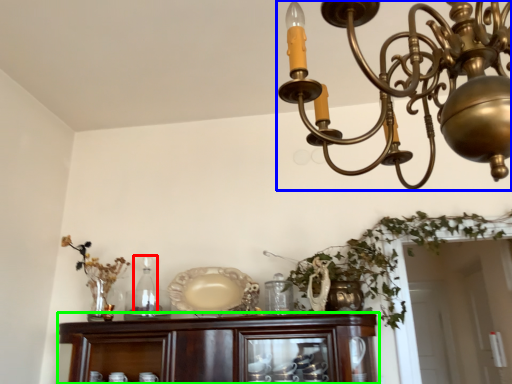
Question: Which object is positioned closest to bottle (highlighted by a red box)? Select from lamp (highlighted by a blue box) and cabinetry (highlighted by a green box).

Choices:
 (A) lamp
 (B) cabinetry

Answer: (B)